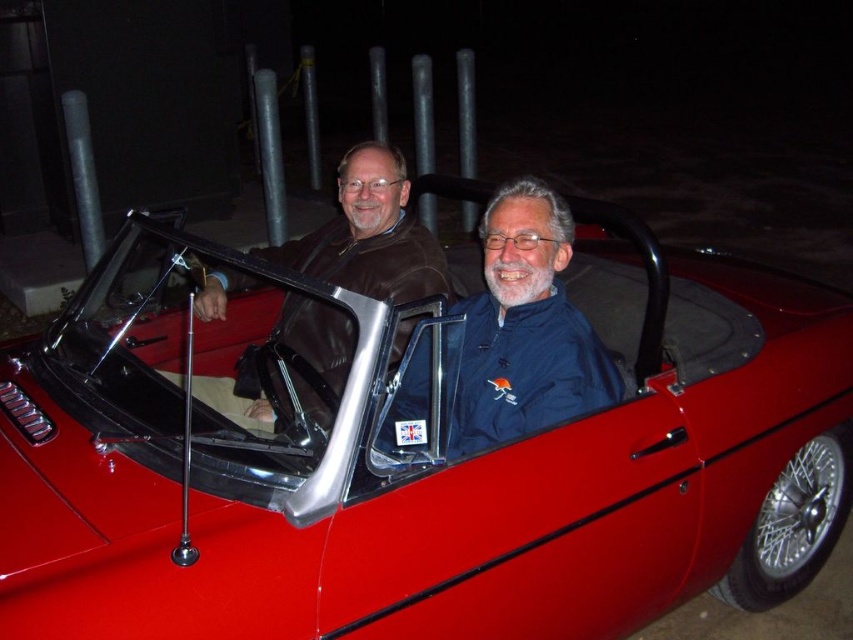
In the scene shown: You are standing at the origin point in the image. Where is the shiny red convertible at center located in terms of coordinates?

The shiny red convertible at center is located at coordinates point (426,467).

You are a photographer trying to capture a clear shot of the shiny red convertible at center and the blue fabric jacket at center. Since you want both subjects to be in focus, which one should you focus on first to ensure the other is also sharp?

You should focus on the shiny red convertible at center first because it is closer to the viewer than the blue fabric jacket at center. By focusing on the closer object, the farther one will also be in focus due to the depth of field.

You are a photographer trying to capture a clear shot of the shiny red convertible at center and the brown leather jacket at center. Which object should you focus on first to ensure it appears sharp in the photo?

You should focus on the shiny red convertible at center first because it is closer to the viewer than the brown leather jacket at center, so focusing on it will keep it sharp while the jacket may appear slightly out of focus.